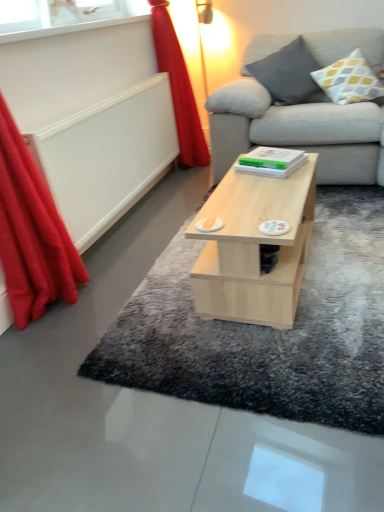
Where is `free space in front of red fabric curtain at left, which ranks as the second curtain in back-to-front order`? The width and height of the screenshot is (384, 512). free space in front of red fabric curtain at left, which ranks as the second curtain in back-to-front order is located at coordinates (56, 343).